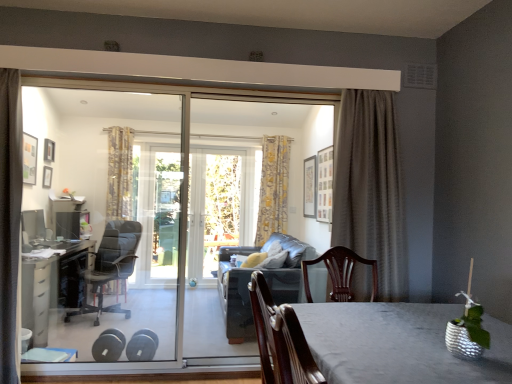
Question: Should I look upward or downward to see yellow floral fabric curtain at center, which is counted as the 2th curtain, starting from the left?

Choices:
 (A) up
 (B) down

Answer: (A)

Question: Does silvery metallic table at center, which ranks as the first table in front-to-back order, have a larger size compared to yellow floral fabric curtain at center, which is counted as the 2th curtain, starting from the left?

Choices:
 (A) yes
 (B) no

Answer: (A)

Question: Is the position of silvery metallic table at center, which is the 2th table in back-to-front order, more distant than that of yellow floral fabric curtain at center, positioned as the 3th curtain in front-to-back order?

Choices:
 (A) no
 (B) yes

Answer: (A)

Question: From a real-world perspective, is silvery metallic table at center, which ranks as the first table in front-to-back order, physically above yellow floral fabric curtain at center, which is counted as the 2th curtain, starting from the left?

Choices:
 (A) yes
 (B) no

Answer: (B)

Question: Can you confirm if silvery metallic table at center, which is counted as the second table, starting from the left, is positioned to the right of yellow floral fabric curtain at center, the second curtain when ordered from right to left?

Choices:
 (A) no
 (B) yes

Answer: (B)

Question: Could yellow floral fabric curtain at center, which is counted as the 2th curtain, starting from the left, be considered to be inside silvery metallic table at center, which is the 2th table in back-to-front order?

Choices:
 (A) no
 (B) yes

Answer: (A)

Question: Can you confirm if silvery metallic table at center, which is the 1th table in right-to-left order, is smaller than yellow floral fabric curtain at center, the second curtain when ordered from right to left?

Choices:
 (A) no
 (B) yes

Answer: (A)

Question: Is black leather office chair at left wider than dark gray leather couch at center?

Choices:
 (A) yes
 (B) no

Answer: (B)

Question: From the image's perspective, is black leather office chair at left under dark gray leather couch at center?

Choices:
 (A) yes
 (B) no

Answer: (B)

Question: Considering the relative sizes of black leather office chair at left and dark gray leather couch at center in the image provided, is black leather office chair at left shorter than dark gray leather couch at center?

Choices:
 (A) no
 (B) yes

Answer: (A)

Question: Can you confirm if black leather office chair at left is smaller than dark gray leather couch at center?

Choices:
 (A) no
 (B) yes

Answer: (B)

Question: From a real-world perspective, is black leather office chair at left over dark gray leather couch at center?

Choices:
 (A) yes
 (B) no

Answer: (A)

Question: Is dark gray leather couch at center a part of black leather office chair at left?

Choices:
 (A) no
 (B) yes

Answer: (A)

Question: Is black plastic desk at left, which appears as the second table when viewed from the right, surrounding black leather office chair at left?

Choices:
 (A) yes
 (B) no

Answer: (B)